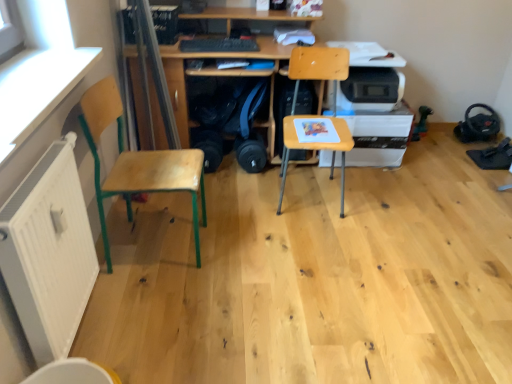
The width and height of the screenshot is (512, 384). Identify the location of free spot behind wooden at left, which ranks as the first chair in left-to-right order. (184, 207).